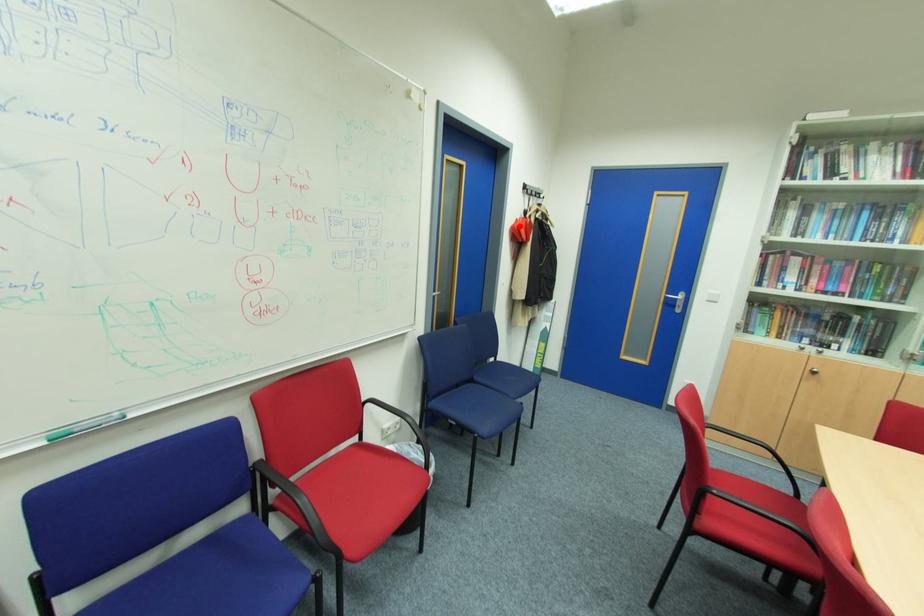
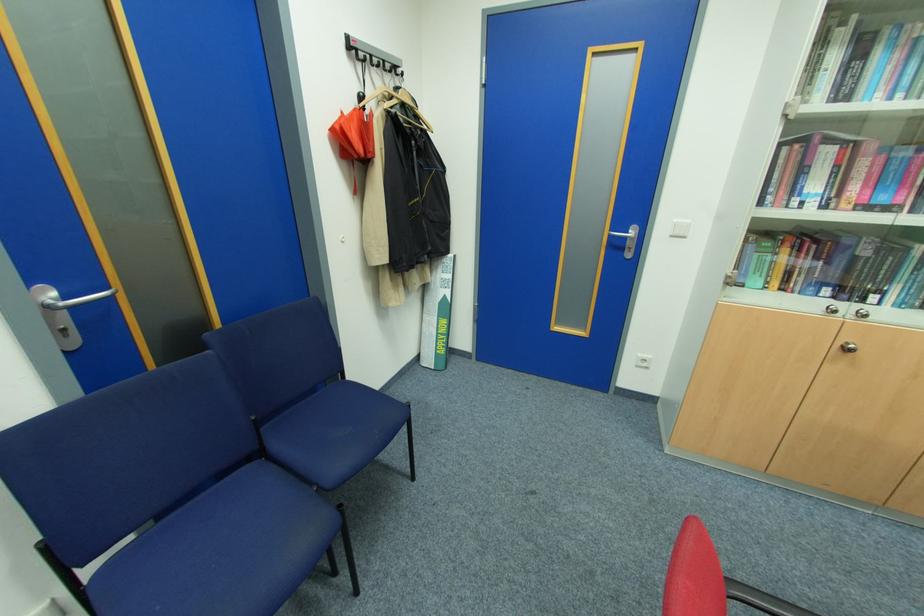
Find the pixel in the second image that matches the highlighted location in the first image.

(341, 127)